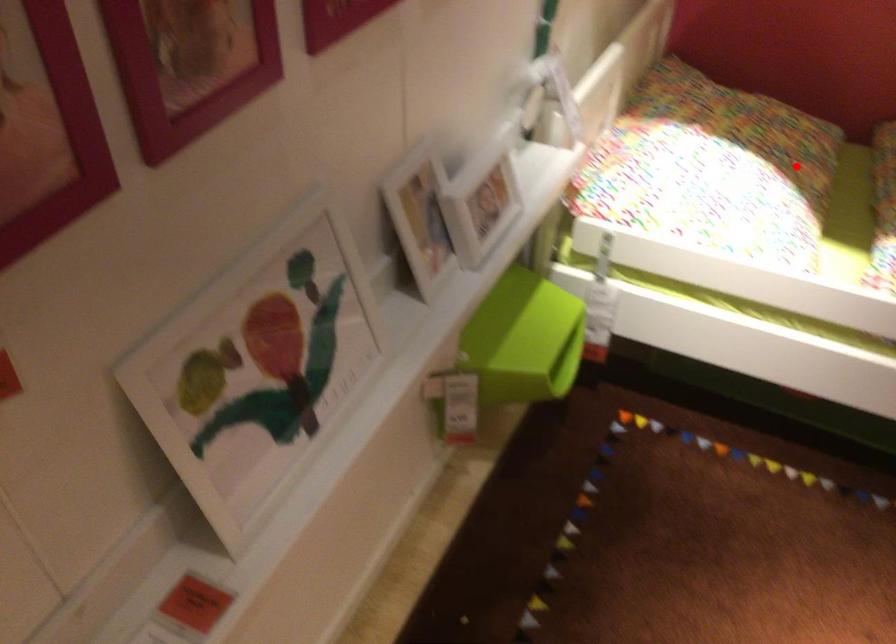
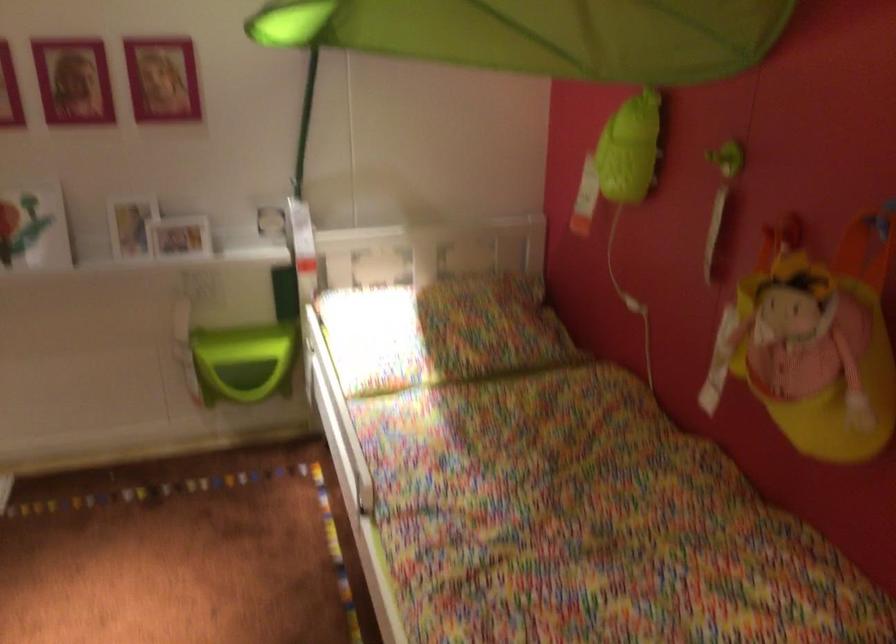
In the second image, find the point that corresponds to the highlighted location in the first image.

(440, 332)